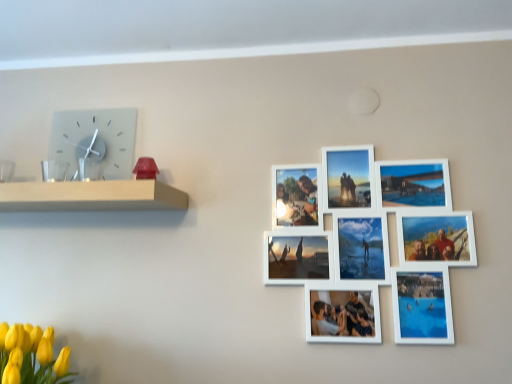
Question: Based on their sizes in the image, would you say yellow matte tulips at lower left is bigger or smaller than matte glass clock at upper left?

Choices:
 (A) big
 (B) small

Answer: (A)

Question: Considering the positions of point (65, 382) and point (87, 119), is point (65, 382) closer or farther from the camera than point (87, 119)?

Choices:
 (A) closer
 (B) farther

Answer: (A)

Question: Which object is positioned farthest from the yellow matte tulips at lower left?

Choices:
 (A) matte glass clock at upper left
 (B) white matte picture frame at upper right
 (C) white wooden shelf at left

Answer: (B)

Question: Based on their relative distances, which object is nearer to the matte glass clock at upper left?

Choices:
 (A) white wooden shelf at left
 (B) yellow matte tulips at lower left
 (C) white matte picture frame at upper right

Answer: (A)